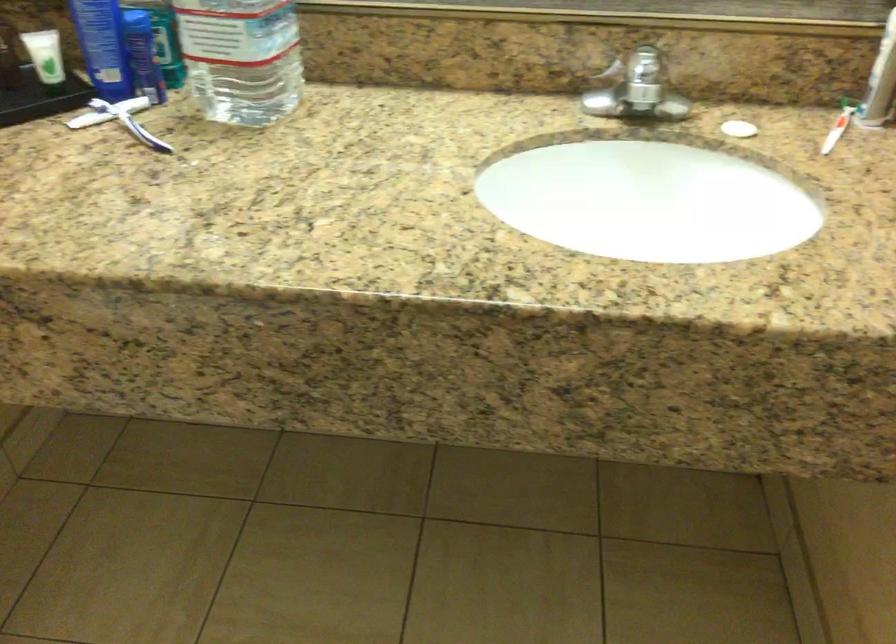
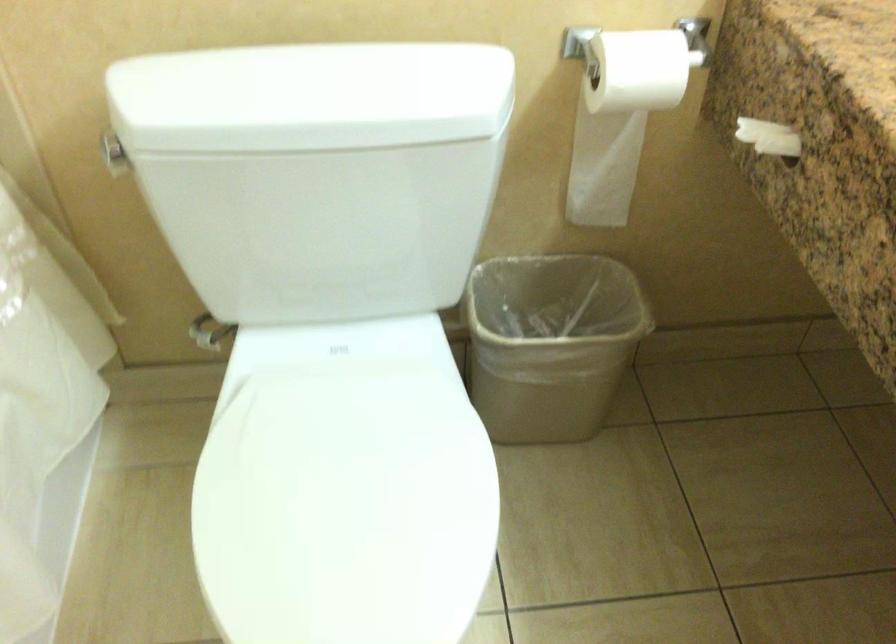
How did the camera likely rotate?

The rotation direction of the camera is left-down.